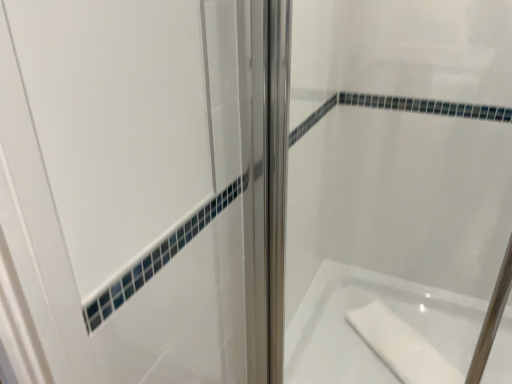
The image size is (512, 384). What do you see at coordinates (398, 191) in the screenshot?
I see `clear glass shower door at center` at bounding box center [398, 191].

At what (x,y) coordinates should I click in order to perform the action: click on white matte soap at lower right. Please return your answer as a coordinate pair (x, y). Looking at the image, I should click on (401, 346).

In the image, is white glossy bathtub at lower right positioned in front of or behind clear glass shower door at center?

In the image, white glossy bathtub at lower right appears behind clear glass shower door at center.

Who is smaller, white glossy bathtub at lower right or clear glass shower door at center?

With smaller size is clear glass shower door at center.

Is white glossy bathtub at lower right wider than clear glass shower door at center?

Correct, the width of white glossy bathtub at lower right exceeds that of clear glass shower door at center.

Is clear glass shower door at center inside white glossy bathtub at lower right?

No, clear glass shower door at center is not surrounded by white glossy bathtub at lower right.

Is point (349, 375) closer to viewer compared to point (385, 309)?

Yes, it is.

How different are the orientations of white glossy bathtub at lower right and white matte soap at lower right in degrees?

They differ by 39.7 degrees in their facing directions.

Can white matte soap at lower right be found inside white glossy bathtub at lower right?

Yes, white matte soap at lower right is surrounded by white glossy bathtub at lower right.

Based on their sizes in the image, would you say white glossy bathtub at lower right is bigger or smaller than white matte soap at lower right?

In the image, white glossy bathtub at lower right appears to be larger than white matte soap at lower right.

Considering the positions of objects clear glass shower door at center and white glossy bathtub at lower right in the image provided, who is more to the left, clear glass shower door at center or white glossy bathtub at lower right?

clear glass shower door at center.

Between clear glass shower door at center and white glossy bathtub at lower right, which one has more height?

With more height is clear glass shower door at center.

Considering the sizes of objects clear glass shower door at center and white glossy bathtub at lower right in the image provided, who is smaller, clear glass shower door at center or white glossy bathtub at lower right?

With smaller size is clear glass shower door at center.

Does white matte soap at lower right have a lesser height compared to white glossy bathtub at lower right?

Indeed, white matte soap at lower right has a lesser height compared to white glossy bathtub at lower right.

Between white matte soap at lower right and white glossy bathtub at lower right, which one has smaller size?

white matte soap at lower right.

From a real-world perspective, who is located lower, white matte soap at lower right or white glossy bathtub at lower right?

In real-world perspective, white glossy bathtub at lower right is lower.

Identify the location of soap that is under the clear glass shower door at center (from a real-world perspective). The height and width of the screenshot is (384, 512). (401, 346).

Does white matte soap at lower right have a greater height compared to clear glass shower door at center?

No, white matte soap at lower right is not taller than clear glass shower door at center.

How much distance is there between white matte soap at lower right and clear glass shower door at center?

A: white matte soap at lower right and clear glass shower door at center are 14.89 inches apart from each other.

Which is in front, white matte soap at lower right or clear glass shower door at center?

clear glass shower door at center is in front.

From a real-world perspective, between clear glass shower door at center and white matte soap at lower right, who is vertically higher?

clear glass shower door at center.

Does point (434, 340) lie in front of point (390, 324)?

That is True.

Considering the sizes of objects clear glass shower door at center and white matte soap at lower right in the image provided, who is shorter, clear glass shower door at center or white matte soap at lower right?

With less height is white matte soap at lower right.

Which is in front, clear glass shower door at center or white matte soap at lower right?

clear glass shower door at center.

Locate an element on the screen. This screenshot has width=512, height=384. bathtub behind the clear glass shower door at center is located at coordinates (360, 337).

Image resolution: width=512 pixels, height=384 pixels. What are the coordinates of `bathtub lying in front of the white matte soap at lower right` in the screenshot? It's located at (360, 337).

Estimate the real-world distances between objects in this image. Which object is further from clear glass shower door at center, white matte soap at lower right or white glossy bathtub at lower right?

Based on the image, white matte soap at lower right appears to be further to clear glass shower door at center.

Considering their positions, is white glossy bathtub at lower right positioned further to white matte soap at lower right than clear glass shower door at center?

clear glass shower door at center is further to white matte soap at lower right.

Which object lies further to the anchor point white glossy bathtub at lower right, white matte soap at lower right or clear glass shower door at center?

The object further to white glossy bathtub at lower right is clear glass shower door at center.

Which object lies further to the anchor point clear glass shower door at center, white glossy bathtub at lower right or white matte soap at lower right?

white matte soap at lower right is further to clear glass shower door at center.

From the image, which object appears to be farther from white matte soap at lower right, clear glass shower door at center or white glossy bathtub at lower right?

clear glass shower door at center is further to white matte soap at lower right.

Considering their positions, is clear glass shower door at center positioned further to white glossy bathtub at lower right than white matte soap at lower right?

Among the two, clear glass shower door at center is located further to white glossy bathtub at lower right.

Image resolution: width=512 pixels, height=384 pixels. In order to click on bathtub between clear glass shower door at center and white matte soap at lower right in the front-back direction in this screenshot , I will do `click(360, 337)`.